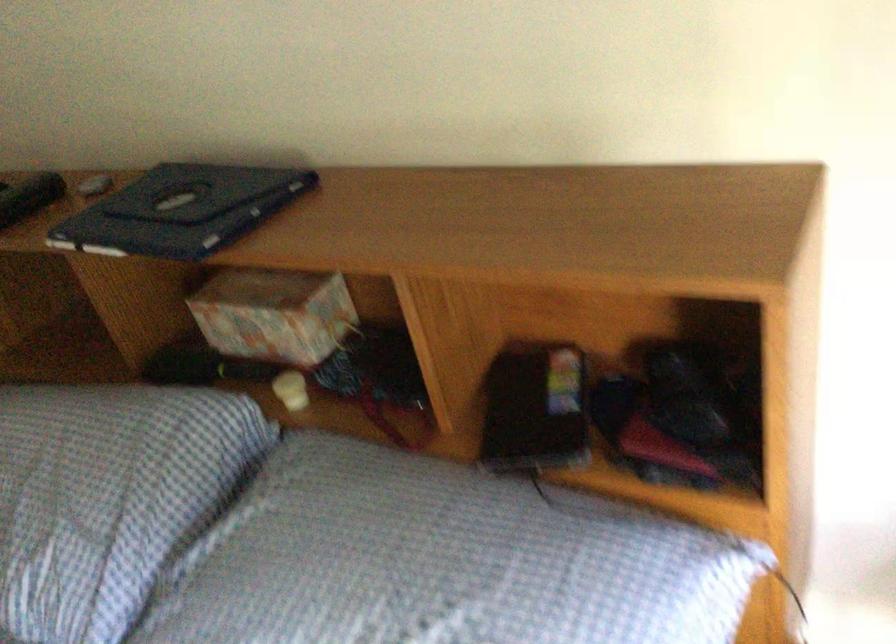
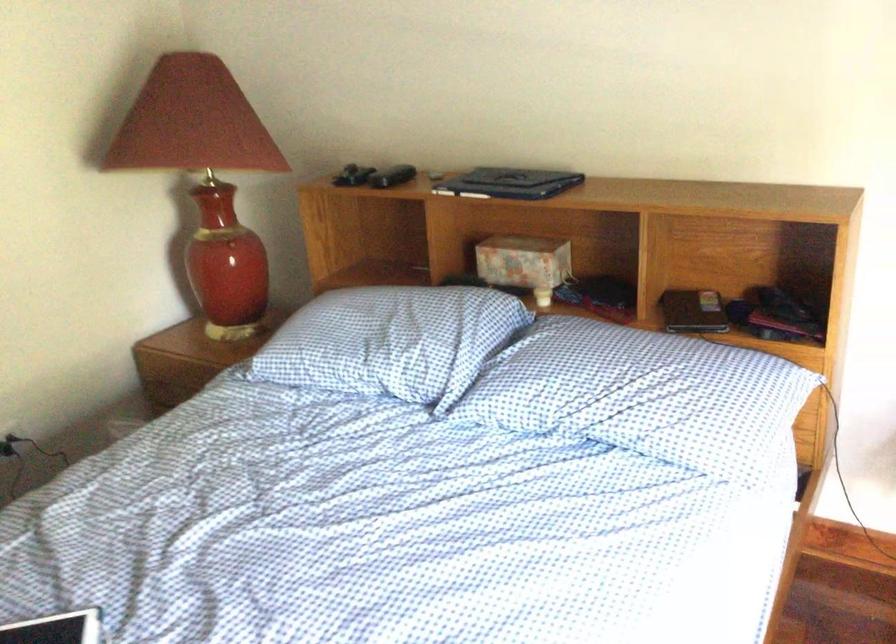
In the second image, find the point that corresponds to (x=263, y=328) in the first image.

(524, 263)